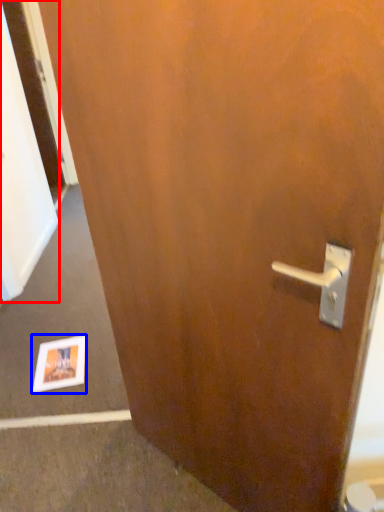
Question: Which object appears closest to the camera in this image, screen door (highlighted by a red box) or postcard (highlighted by a blue box)?

Choices:
 (A) screen door
 (B) postcard

Answer: (B)